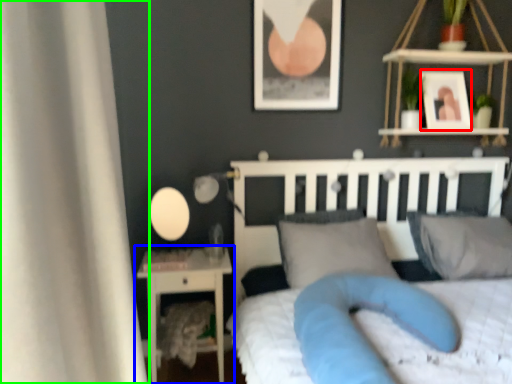
Question: Estimate the real-world distances between objects in this image. Which object is closer to picture frame (highlighted by a red box), nightstand (highlighted by a blue box) or curtain (highlighted by a green box)?

Choices:
 (A) nightstand
 (B) curtain

Answer: (A)